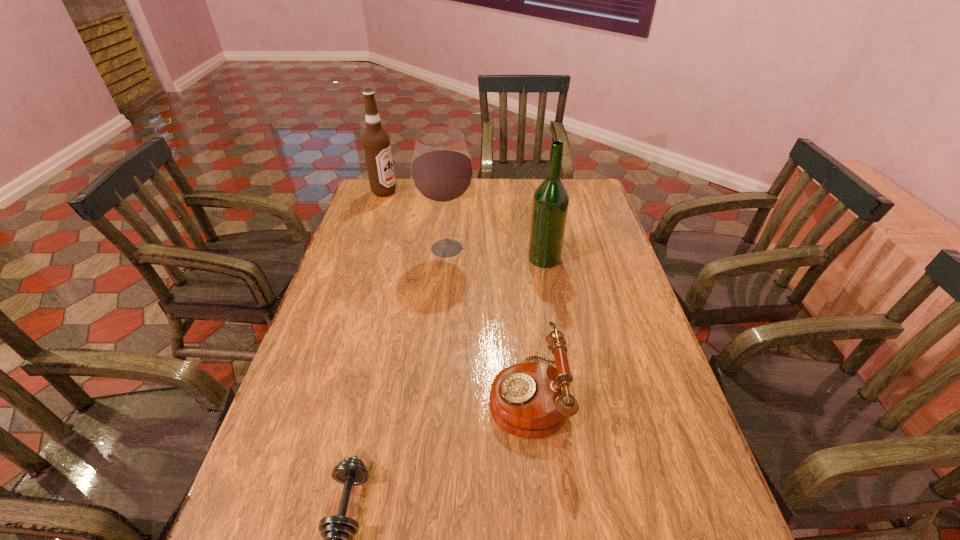
Locate an element on the screen. free space between the telephone and the rightmost alcohol is located at coordinates pyautogui.click(x=536, y=327).

Identify the location of vacant area between the telephone and the farthest alcohol. (456, 294).

Locate an element on the screen. This screenshot has height=540, width=960. unoccupied area between the second alcohol from right to left and the telephone is located at coordinates (488, 322).

Image resolution: width=960 pixels, height=540 pixels. In order to click on free space between the rightmost alcohol and the fourth tallest object in this screenshot , I will do `click(536, 327)`.

Locate an element on the screen. Image resolution: width=960 pixels, height=540 pixels. free space between the telephone and the leftmost object is located at coordinates (456, 294).

The height and width of the screenshot is (540, 960). Find the location of `free space between the rightmost alcohol and the farthest object`. free space between the rightmost alcohol and the farthest object is located at coordinates (465, 225).

The image size is (960, 540). Find the location of `empty location between the third object from right to left and the farthest object`. empty location between the third object from right to left and the farthest object is located at coordinates (416, 220).

The height and width of the screenshot is (540, 960). What are the coordinates of `object that stands as the closest to the leftmost alcohol` in the screenshot? It's located at (442, 172).

Locate which object is the fourth closest to the second alcohol from right to left. Please provide its 2D coordinates. Your answer should be formatted as a tuple, i.e. [(x, y)], where the tuple contains the x and y coordinates of a point satisfying the conditions above.

[(337, 531)]

Locate an element on the screen. The height and width of the screenshot is (540, 960). the second closest alcohol to the fourth farthest object is located at coordinates (442, 172).